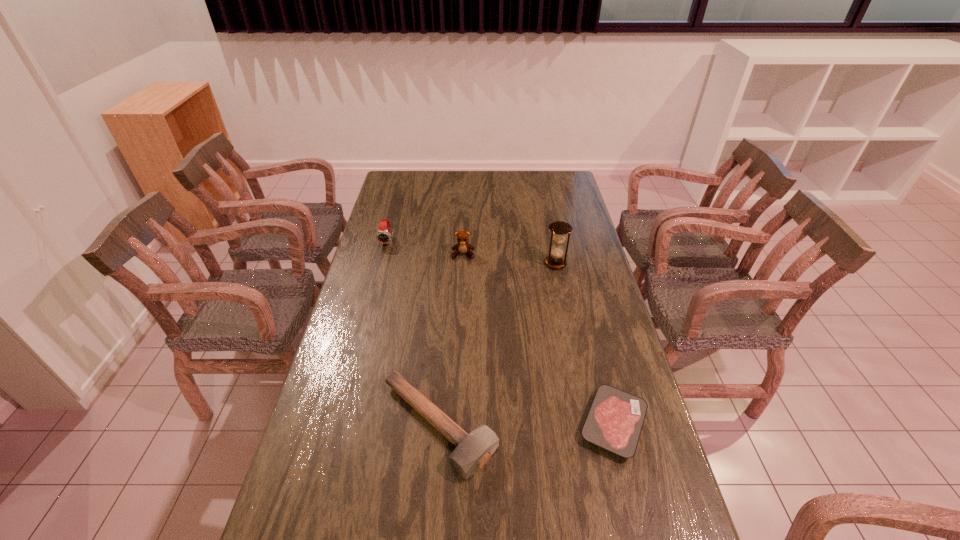
Where is `free space that is in between the shortest object and the watch`? The width and height of the screenshot is (960, 540). free space that is in between the shortest object and the watch is located at coordinates (500, 333).

This screenshot has height=540, width=960. What are the coordinates of `vacant area between the fourth tallest object and the steak` in the screenshot? It's located at (526, 425).

I want to click on vacant area that lies between the farthest object and the mallet, so click(413, 334).

This screenshot has width=960, height=540. I want to click on vacant space in between the farthest object and the steak, so click(500, 333).

Where is `free space between the steak and the second shortest object`? The image size is (960, 540). free space between the steak and the second shortest object is located at coordinates (526, 425).

What are the coordinates of `free space between the hourglass and the shortest object` in the screenshot? It's located at pyautogui.click(x=585, y=343).

Find the location of a particular element. empty location between the farthest object and the teddy bear is located at coordinates (425, 248).

You are a GUI agent. You are given a task and a screenshot of the screen. Output one action in this format:
    pyautogui.click(x=<x>, y=<y>)
    Task: Click on the free space between the teddy bear and the fourth tallest object
    The width and height of the screenshot is (960, 540).
    Given the screenshot: What is the action you would take?
    pyautogui.click(x=451, y=340)

Locate which object ranks second in proximity to the mallet. Please provide its 2D coordinates. Your answer should be formatted as a tuple, i.e. [(x, y)], where the tuple contains the x and y coordinates of a point satisfying the conditions above.

[(559, 229)]

Identify which object is the nearest to the hourglass. Please provide its 2D coordinates. Your answer should be formatted as a tuple, i.e. [(x, y)], where the tuple contains the x and y coordinates of a point satisfying the conditions above.

[(462, 246)]